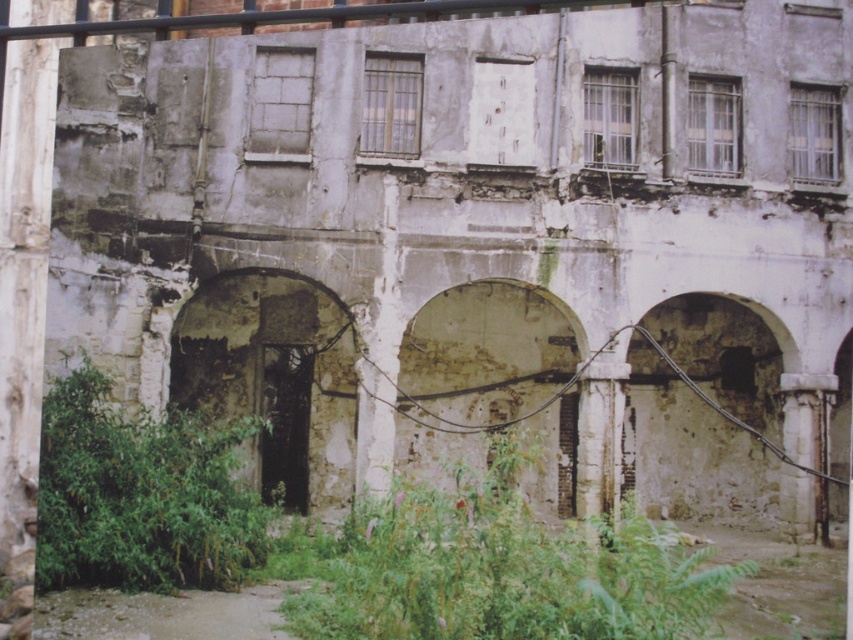
Consider the image. Who is higher up, green leafy plant at lower left or rusty stone archway at center left?

rusty stone archway at center left

This screenshot has height=640, width=853. Find the location of `green leafy plant at lower left`. green leafy plant at lower left is located at coordinates (141, 493).

Is point (146, 588) positioned behind point (282, 483)?

No, it is in front of (282, 483).

Find the location of `green leafy plant at lower left`. green leafy plant at lower left is located at coordinates (141, 493).

Is point (413, 577) behind point (36, 556)?

No, (413, 577) is closer to viewer.

Can you confirm if green leafy plants at center is positioned above green leafy plant at lower left?

No.

Is point (456, 592) behind point (155, 433)?

No.

What are the coordinates of `green leafy plants at center` in the screenshot? It's located at (503, 570).

Is green leafy plant at lower left further to the viewer compared to weathered stone archway at center?

No, it is not.

Can you confirm if green leafy plant at lower left is positioned below weathered stone archway at center?

Yes, green leafy plant at lower left is below weathered stone archway at center.

Who is more distant from viewer, (39, 474) or (537, 385)?

Positioned behind is point (537, 385).

The height and width of the screenshot is (640, 853). I want to click on green leafy plant at lower left, so click(141, 493).